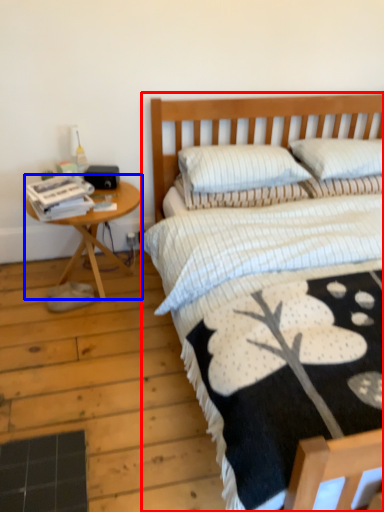
Question: Which point is closer to the camera, bed (highlighted by a red box) or table (highlighted by a blue box)?

Choices:
 (A) bed
 (B) table

Answer: (A)